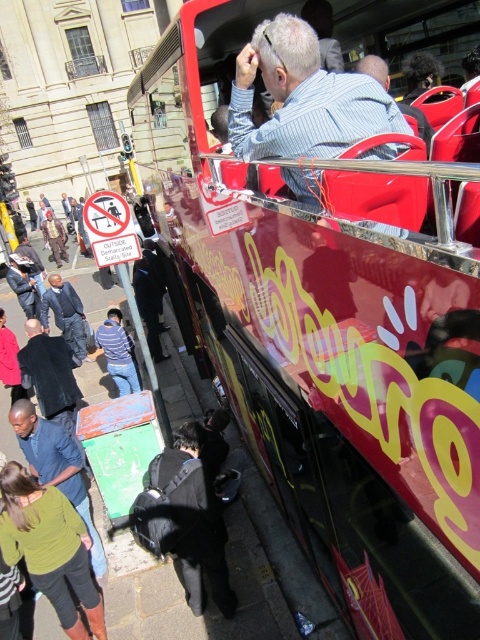
From the picture: Who is shorter, blue striped shirt at upper center or black leather backpack at lower center?

blue striped shirt at upper center

Does blue striped shirt at upper center appear on the right side of black leather backpack at lower center?

Correct, you'll find blue striped shirt at upper center to the right of black leather backpack at lower center.

Between point (247, 76) and point (154, 520), which one is positioned in front?

Point (247, 76) is more forward.

Where is `blue striped shirt at upper center`? blue striped shirt at upper center is located at coordinates (302, 99).

The image size is (480, 640). Find the location of `blue denim shirt at lower left`. blue denim shirt at lower left is located at coordinates (57, 468).

Can you confirm if blue denim shirt at lower left is positioned above black matte jacket at lower left?

Incorrect, blue denim shirt at lower left is not positioned above black matte jacket at lower left.

Is point (60, 481) closer to viewer compared to point (23, 369)?

Yes, it is in front of point (23, 369).

Where is `blue denim shirt at lower left`? The image size is (480, 640). blue denim shirt at lower left is located at coordinates (57, 468).

Does blue denim shirt at lower left appear on the left side of striped fabric shirt at lower center?

In fact, blue denim shirt at lower left is to the right of striped fabric shirt at lower center.

Who is more distant from viewer, (95, 557) or (126, 365)?

Point (126, 365)

Where is `blue denim shirt at lower left`? blue denim shirt at lower left is located at coordinates (57, 468).